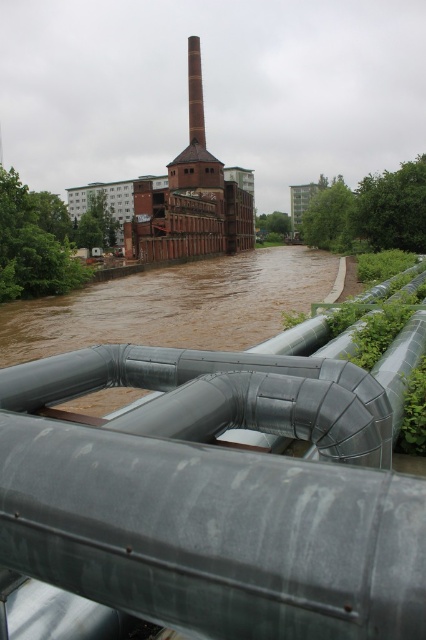
Who is lower down, brown muddy water at center or smooth brick chimney at center?

brown muddy water at center is lower down.

Is point (115, 320) positioned after point (192, 124)?

No, (115, 320) is closer to viewer.

Identify the location of brown muddy water at center. (173, 305).

This screenshot has height=640, width=426. Identify the location of brown muddy water at center. (173, 305).

Between point (276, 260) and point (196, 164), which one is positioned in front?

Positioned in front is point (276, 260).

Is brown muddy water at center to the left of red brick chimney at center from the viewer's perspective?

Incorrect, brown muddy water at center is not on the left side of red brick chimney at center.

Which is behind, point (334, 257) or point (195, 77)?

Positioned behind is point (195, 77).

This screenshot has height=640, width=426. I want to click on brown muddy water at center, so click(x=173, y=305).

Locate an element on the screen. Image resolution: width=426 pixels, height=640 pixels. galvanized steel pipes at center is located at coordinates (212, 493).

Find the location of a particular element. This screenshot has width=426, height=640. galvanized steel pipes at center is located at coordinates (212, 493).